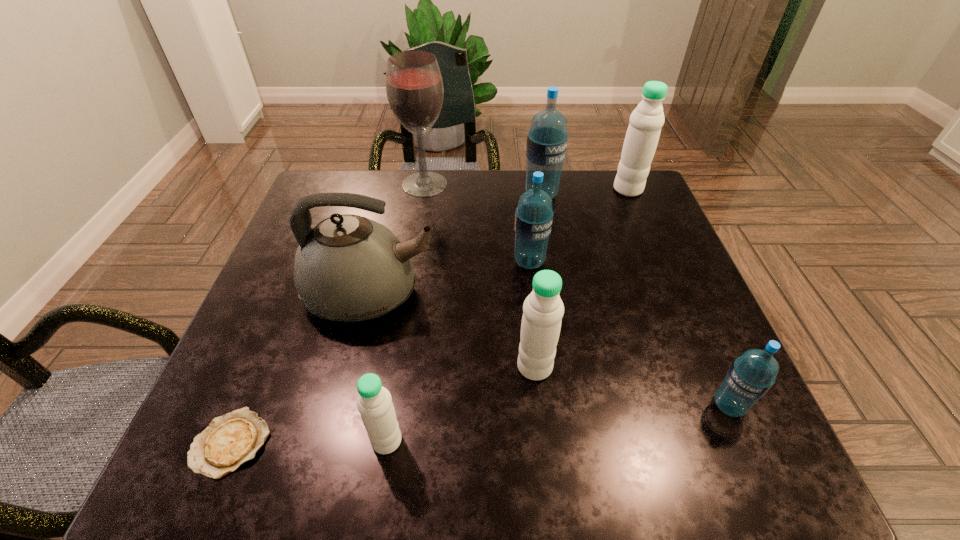
Identify the location of alcohol. (414, 86).

This screenshot has height=540, width=960. In order to click on the farthest white water bottle in this screenshot , I will do `click(642, 136)`.

Locate an element on the screen. The height and width of the screenshot is (540, 960). the biggest white water bottle is located at coordinates (642, 136).

What are the coordinates of `the biggest blue water bottle` in the screenshot? It's located at (547, 139).

At what (x,y) coordinates should I click in order to perform the action: click on gray kettle. Please return your answer as a coordinate pair (x, y). Looking at the image, I should click on (349, 268).

Find the location of `the second farthest white water bottle`. the second farthest white water bottle is located at coordinates (543, 309).

Image resolution: width=960 pixels, height=540 pixels. What are the coordinates of `the second white water bottle from left to right` in the screenshot? It's located at (543, 309).

At what (x,y) coordinates should I click in order to perform the action: click on the fourth nearest water bottle. Please return your answer as a coordinate pair (x, y). Looking at the image, I should click on (533, 217).

Where is `the second nearest blue water bottle`? This screenshot has height=540, width=960. the second nearest blue water bottle is located at coordinates (533, 217).

Find the location of a particular element. The height and width of the screenshot is (540, 960). the fifth farthest water bottle is located at coordinates (751, 375).